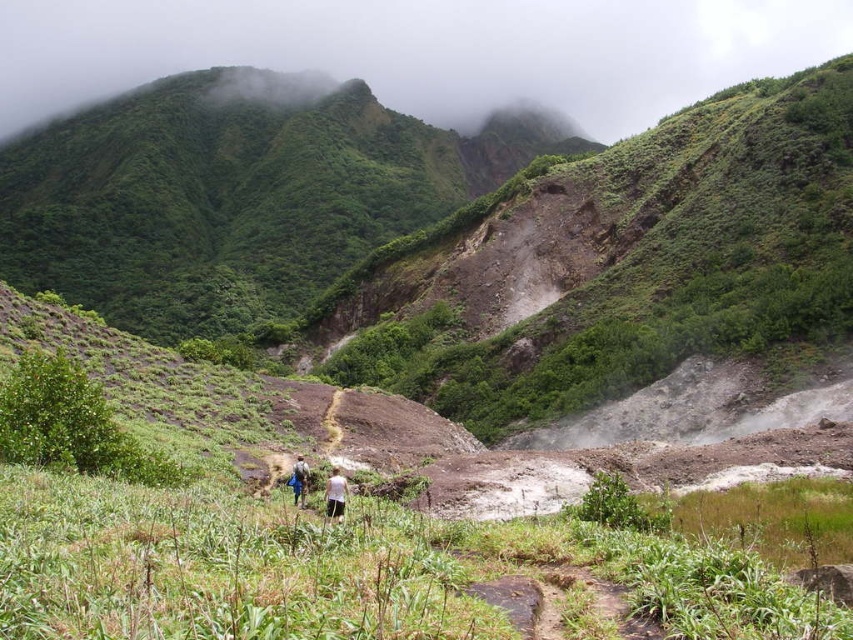
Question: Estimate the real-world distances between objects in this image. Which object is farther from the white fabric shirt at center?

Choices:
 (A) blue fabric couple at center
 (B) green grassy mountain at upper center
 (C) blue fabric bag at center

Answer: (B)

Question: Which object appears farthest from the camera in this image?

Choices:
 (A) green grassy mountain at upper center
 (B) blue fabric couple at center
 (C) blue fabric bag at center
 (D) white fabric shirt at center

Answer: (A)

Question: Considering the real-world distances, which object is closest to the white fabric shirt at center?

Choices:
 (A) blue fabric couple at center
 (B) blue fabric bag at center

Answer: (A)

Question: Can you confirm if green grassy mountain at upper center is bigger than blue fabric couple at center?

Choices:
 (A) no
 (B) yes

Answer: (B)

Question: Does green grassy mountain at upper center lie behind blue fabric bag at center?

Choices:
 (A) yes
 (B) no

Answer: (A)

Question: Does blue fabric couple at center have a greater width compared to white fabric shirt at center?

Choices:
 (A) no
 (B) yes

Answer: (B)